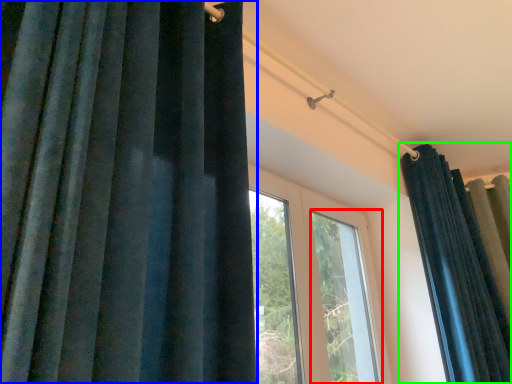
Question: Based on their relative distances, which object is farther from window (highlighted by a red box)? Choose from curtain (highlighted by a blue box) and curtain (highlighted by a green box).

Choices:
 (A) curtain
 (B) curtain

Answer: (A)